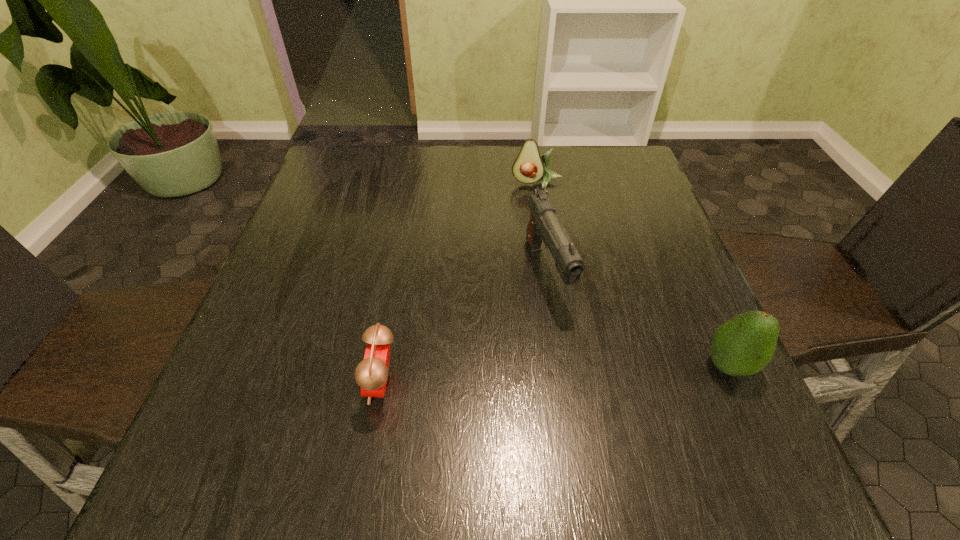
What are the coordinates of `free space located on the seed side of the left avocado` in the screenshot? It's located at (524, 299).

The width and height of the screenshot is (960, 540). Find the location of `vacant space located 0.310m on the seed side of the left avocado`. vacant space located 0.310m on the seed side of the left avocado is located at coordinates click(526, 278).

This screenshot has height=540, width=960. I want to click on vacant space located 0.100m on the seed side of the left avocado, so click(532, 217).

Image resolution: width=960 pixels, height=540 pixels. I want to click on vacant space situated 0.160m in the direction the second farthest object is aimed, so click(588, 388).

I want to click on free region located in the direction the second farthest object is aimed, so click(566, 336).

The height and width of the screenshot is (540, 960). Identify the location of blank space located 0.230m in the direction the second farthest object is aimed. (606, 426).

I want to click on object at the far edge, so click(529, 167).

Image resolution: width=960 pixels, height=540 pixels. In order to click on alarm clock located at the near edge in this screenshot , I will do `click(371, 374)`.

In order to click on avocado that is at the near edge in this screenshot , I will do `click(743, 345)`.

You are a GUI agent. You are given a task and a screenshot of the screen. Output one action in this format:
    pyautogui.click(x=<x>, y=<y>)
    Task: Click on the object that is at the right edge
    This screenshot has width=960, height=540.
    Given the screenshot: What is the action you would take?
    pyautogui.click(x=743, y=345)